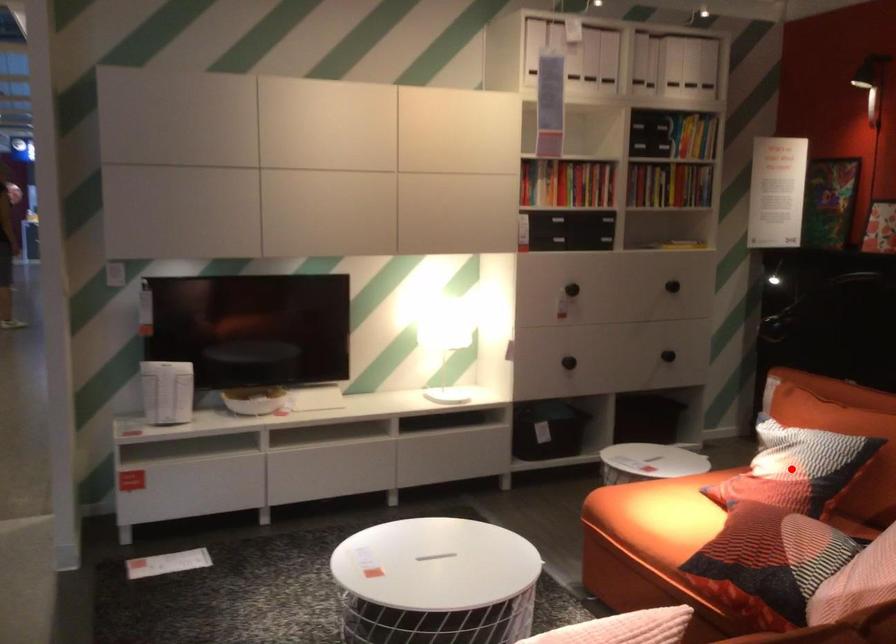
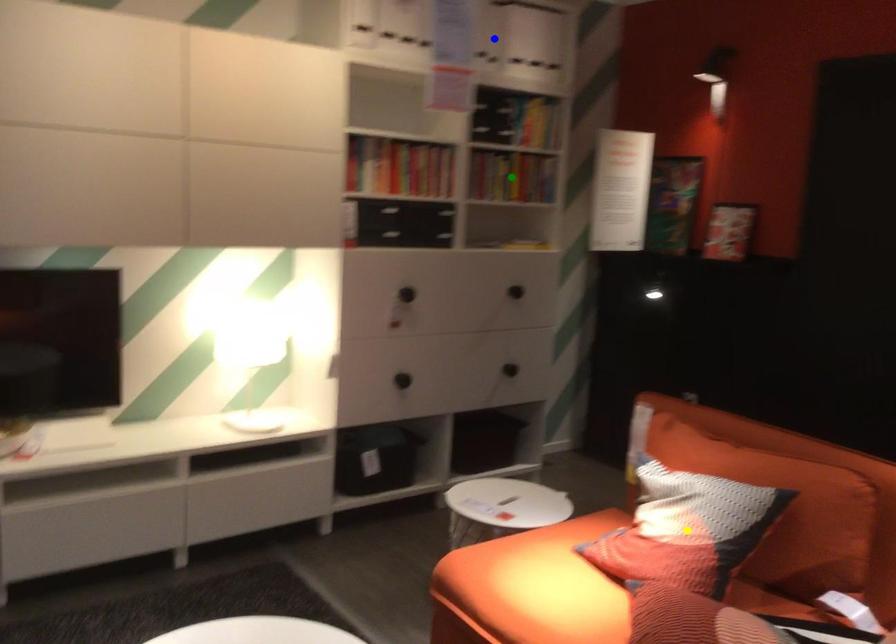
Question: I am providing you with two images of the same scene from different viewpoints. A red point is marked on the first image. You are given multiple points on the second image. Which point in image 2 is actually the same real-world point as the red point in image 1?

Choices:
 (A) yellow point
 (B) green point
 (C) blue point

Answer: (A)